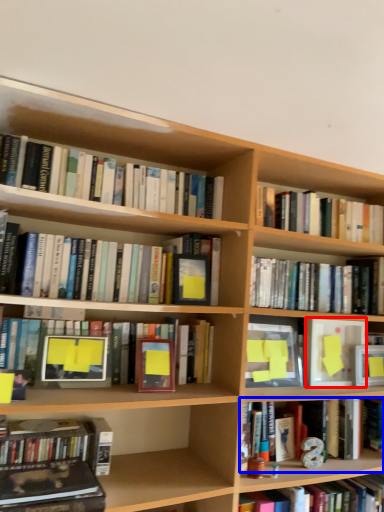
Question: Which object is closer to the camera taking this photo, paperback book (highlighted by a red box) or book (highlighted by a blue box)?

Choices:
 (A) paperback book
 (B) book

Answer: (B)